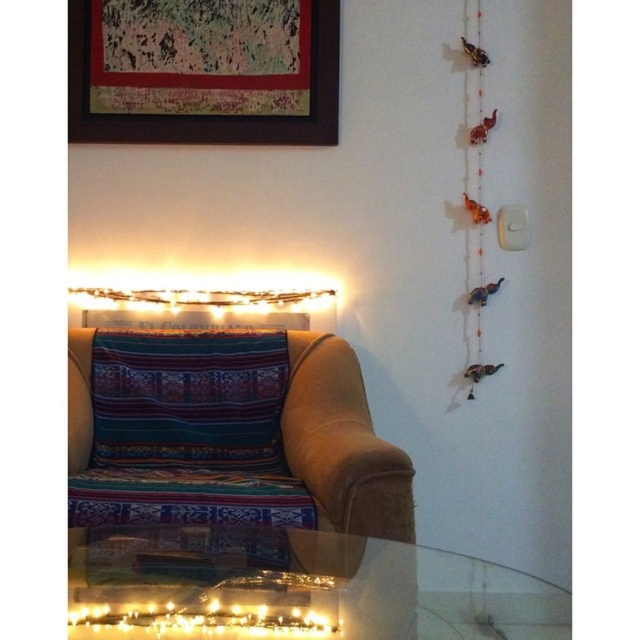
Question: Which point is closer to the camera?

Choices:
 (A) multicolored woven fabric couch at center
 (B) textured woven pillow at center
 (C) wooden framed artwork at upper left

Answer: (A)

Question: Which object is the farthest from the textured woven pillow at center?

Choices:
 (A) wooden framed artwork at upper left
 (B) multicolored woven fabric couch at center
 (C) orange beaded string at right
 (D) transparent glass table at lower center

Answer: (C)

Question: Which of these objects is positioned farthest from the wooden framed artwork at upper left?

Choices:
 (A) orange beaded string at right
 (B) transparent glass table at lower center

Answer: (B)

Question: Is transparent glass table at lower center bigger than textured woven pillow at center?

Choices:
 (A) no
 (B) yes

Answer: (B)

Question: Is transparent glass table at lower center bigger than wooden framed artwork at upper left?

Choices:
 (A) no
 (B) yes

Answer: (B)

Question: Is textured woven pillow at center below orange beaded string at right?

Choices:
 (A) yes
 (B) no

Answer: (A)